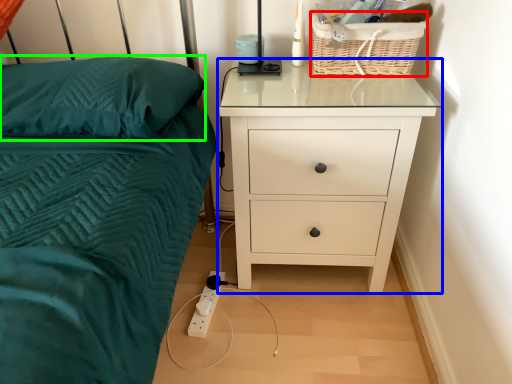
Question: Based on their relative distances, which object is farther from basket (highlighted by a red box)? Choose from chest of drawers (highlighted by a blue box) and pillow (highlighted by a green box).

Choices:
 (A) chest of drawers
 (B) pillow

Answer: (B)